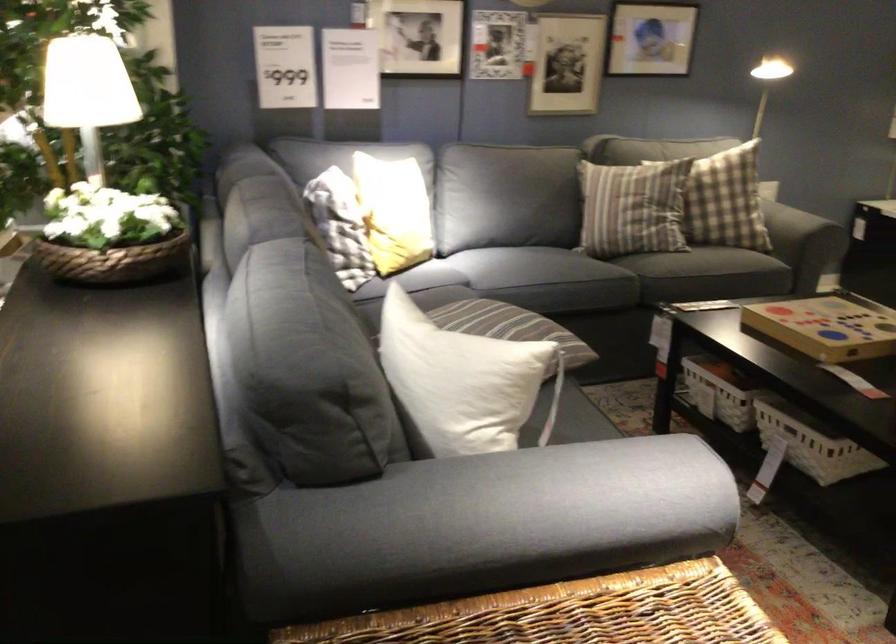
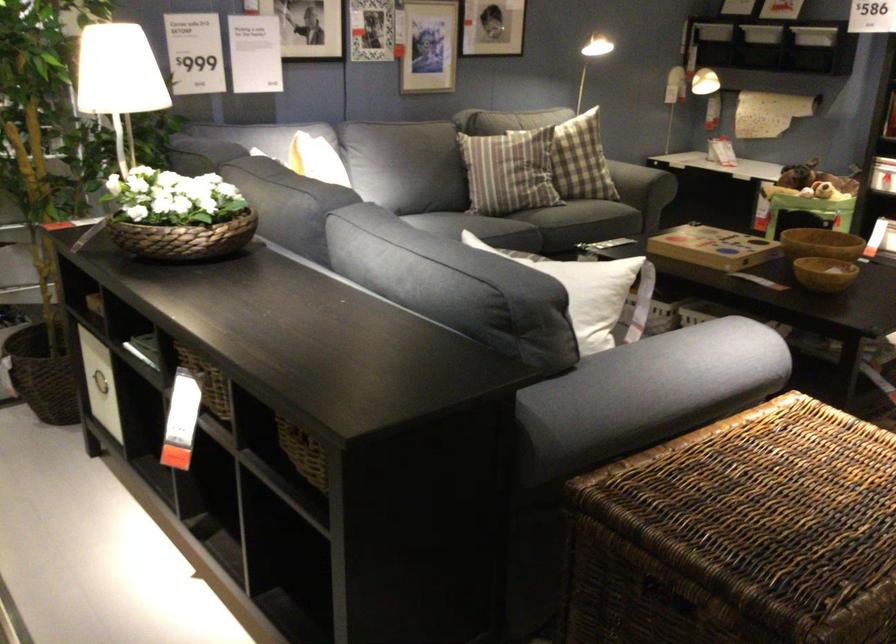
Where in the second image is the point corresponding to [556,252] from the first image?

(484, 227)